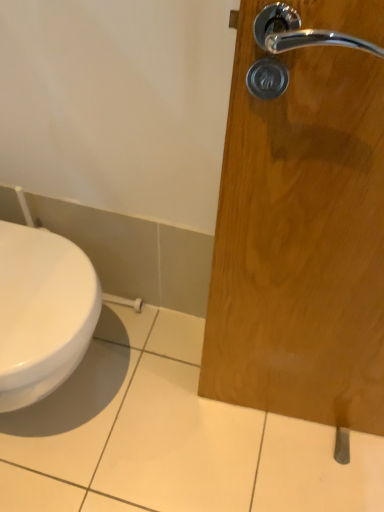
Question: Is white glossy toilet at lower left bigger or smaller than satin nickel door handle at lower right?

Choices:
 (A) small
 (B) big

Answer: (B)

Question: Considering the positions of white glossy toilet at lower left and satin nickel door handle at lower right in the image, is white glossy toilet at lower left taller or shorter than satin nickel door handle at lower right?

Choices:
 (A) short
 (B) tall

Answer: (B)

Question: Do you think white glossy toilet at lower left is within satin nickel door handle at lower right, or outside of it?

Choices:
 (A) outside
 (B) inside

Answer: (A)

Question: Is satin nickel door handle at lower right wider or thinner than white glossy toilet at lower left?

Choices:
 (A) wide
 (B) thin

Answer: (B)

Question: From the image's perspective, is satin nickel door handle at lower right above or below white glossy toilet at lower left?

Choices:
 (A) above
 (B) below

Answer: (B)

Question: Based on their positions, is satin nickel door handle at lower right located to the left or right of white glossy toilet at lower left?

Choices:
 (A) left
 (B) right

Answer: (B)

Question: Based on their sizes in the image, would you say satin nickel door handle at lower right is bigger or smaller than white glossy toilet at lower left?

Choices:
 (A) small
 (B) big

Answer: (A)